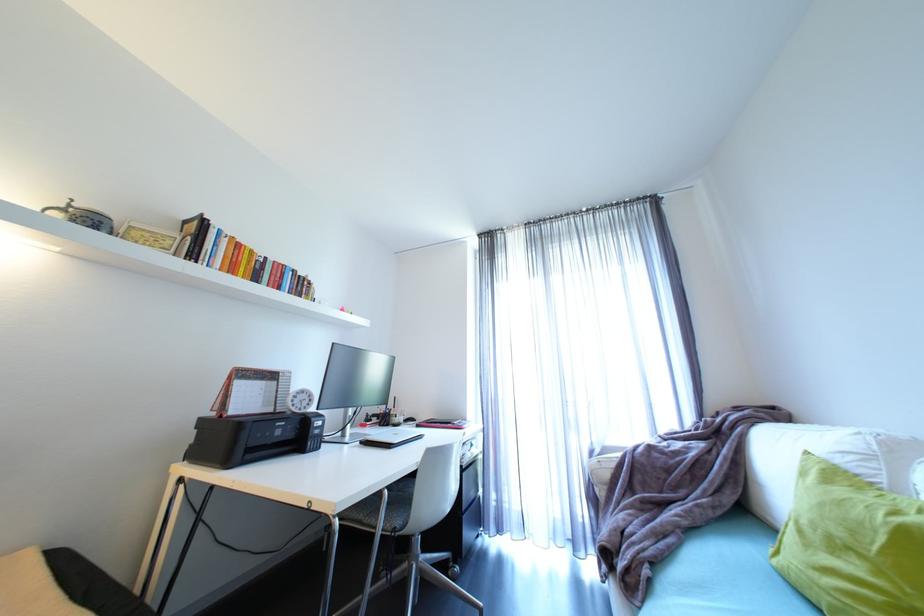
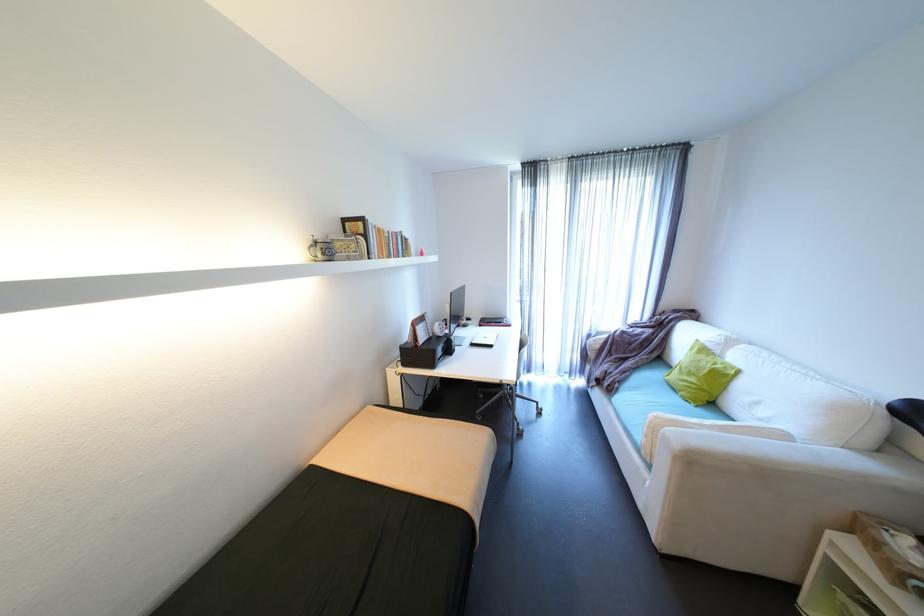
In the second image, find the point that corresponds to point 457,424 in the first image.

(508, 323)